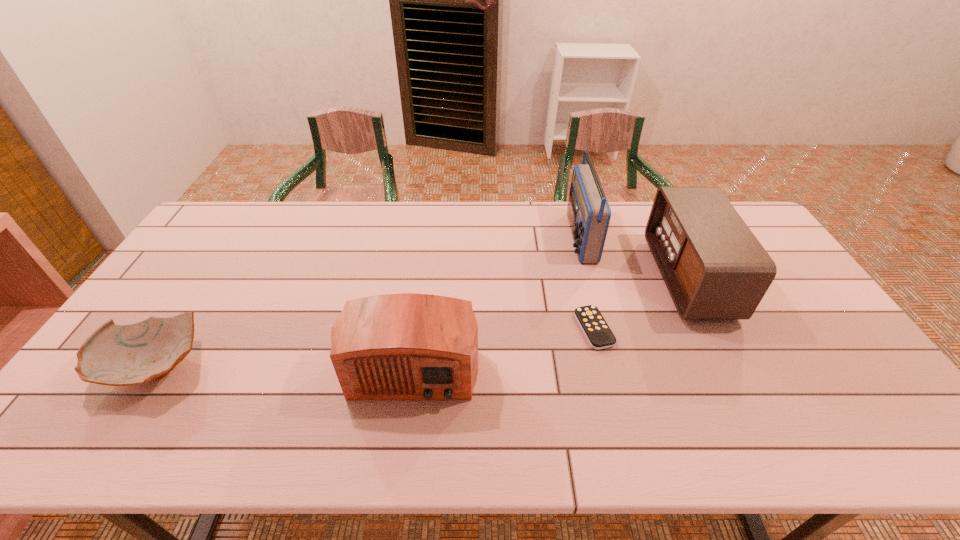
Locate an element on the screen. This screenshot has width=960, height=540. the second radio receiver from left to right is located at coordinates (588, 211).

Locate an element on the screen. the rightmost radio receiver is located at coordinates (714, 268).

In order to click on the second object from left to right in this screenshot , I will do `click(407, 346)`.

Where is `the fourth tallest object`? the fourth tallest object is located at coordinates (115, 355).

Find the location of a particular element. Image resolution: width=960 pixels, height=540 pixels. the leftmost object is located at coordinates 115,355.

Locate an element on the screen. This screenshot has width=960, height=540. remote control is located at coordinates (599, 335).

The height and width of the screenshot is (540, 960). Find the location of `free point located on the front panel of the second radio receiver from right to left`. free point located on the front panel of the second radio receiver from right to left is located at coordinates (545, 237).

The width and height of the screenshot is (960, 540). I want to click on free spot located on the front panel of the second radio receiver from right to left, so click(x=522, y=237).

Where is `blank space located 0.230m on the front panel of the second radio receiver from right to left`? blank space located 0.230m on the front panel of the second radio receiver from right to left is located at coordinates (502, 237).

This screenshot has width=960, height=540. I want to click on vacant area situated on the front-facing side of the rightmost radio receiver, so click(x=602, y=278).